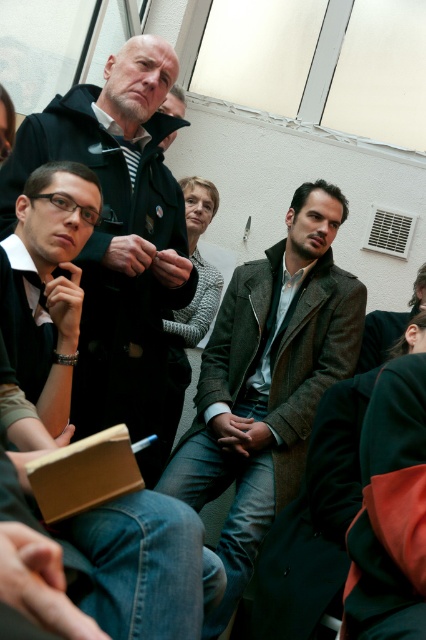
In the scene shown: Can you confirm if brown woolen coat at center is smaller than matte black jacket at center?

Actually, brown woolen coat at center might be larger than matte black jacket at center.

Is brown woolen coat at center closer to the viewer compared to matte black jacket at center?

No, it is behind matte black jacket at center.

Is point (261, 326) farther from camera compared to point (152, 611)?

Yes, it is.

What are the coordinates of `brown woolen coat at center` in the screenshot? It's located at (267, 381).

Between point (233, 573) and point (141, 252), which one is positioned in front?

Positioned in front is point (141, 252).

Is brown woolen coat at center bigger than dark gray wool coat at center?

Indeed, brown woolen coat at center has a larger size compared to dark gray wool coat at center.

Between point (293, 445) and point (158, 340), which one is positioned behind?

The point (293, 445) is behind.

The width and height of the screenshot is (426, 640). I want to click on brown woolen coat at center, so click(267, 381).

Does dark gray wool coat at center come behind matte black jacket at center?

That is True.

Does dark gray wool coat at center have a greater width compared to matte black jacket at center?

Yes, dark gray wool coat at center is wider than matte black jacket at center.

Identify the location of dark gray wool coat at center. The image size is (426, 640). (118, 228).

Find the location of `dark gray wool coat at center`. dark gray wool coat at center is located at coordinates (118, 228).